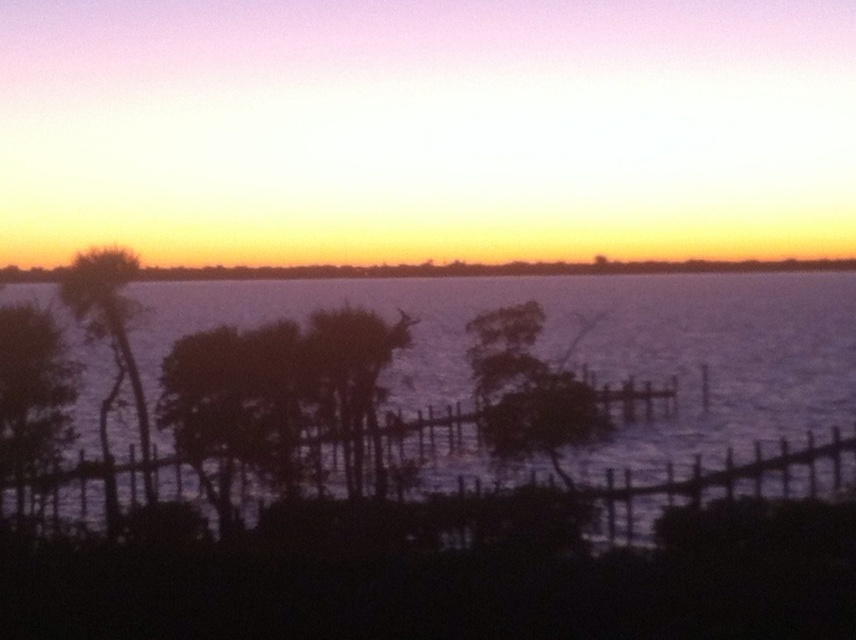
Can you confirm if purple water at center is thinner than silhouette wood tree at center?

Incorrect, purple water at center's width is not less than silhouette wood tree at center's.

Measure the distance between point (x=265, y=300) and camera.

A distance of 135.76 meters exists between point (x=265, y=300) and camera.

Between point (88, 483) and point (308, 328), which one is positioned behind?

The point (88, 483) is more distant.

The height and width of the screenshot is (640, 856). I want to click on purple water at center, so pyautogui.click(x=587, y=346).

Does purple water at center have a greater width compared to silhouette palm tree at left?

Indeed, purple water at center has a greater width compared to silhouette palm tree at left.

Does purple water at center appear on the right side of silhouette palm tree at left?

Correct, you'll find purple water at center to the right of silhouette palm tree at left.

What do you see at coordinates (587, 346) in the screenshot? I see `purple water at center` at bounding box center [587, 346].

This screenshot has width=856, height=640. What are the coordinates of `purple water at center` in the screenshot? It's located at (587, 346).

Who is positioned more to the left, dark green leafy tree at left or silhouette wood tree at center?

dark green leafy tree at left

Consider the image. Is dark green leafy tree at left wider than silhouette wood tree at center?

No, dark green leafy tree at left is not wider than silhouette wood tree at center.

At what (x,y) coordinates should I click in order to perform the action: click on dark green leafy tree at left. Please return your answer as a coordinate pair (x, y). Image resolution: width=856 pixels, height=640 pixels. Looking at the image, I should click on (33, 394).

Locate an element on the screen. Image resolution: width=856 pixels, height=640 pixels. dark green leafy tree at left is located at coordinates (33, 394).